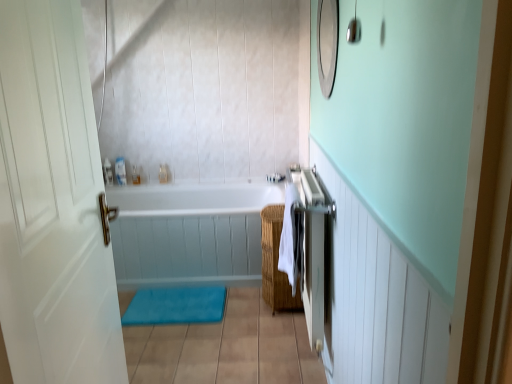
Where is `vacant region below white cotton beach towel at right (from a real-world perspective)`? Image resolution: width=512 pixels, height=384 pixels. vacant region below white cotton beach towel at right (from a real-world perspective) is located at coordinates (286, 360).